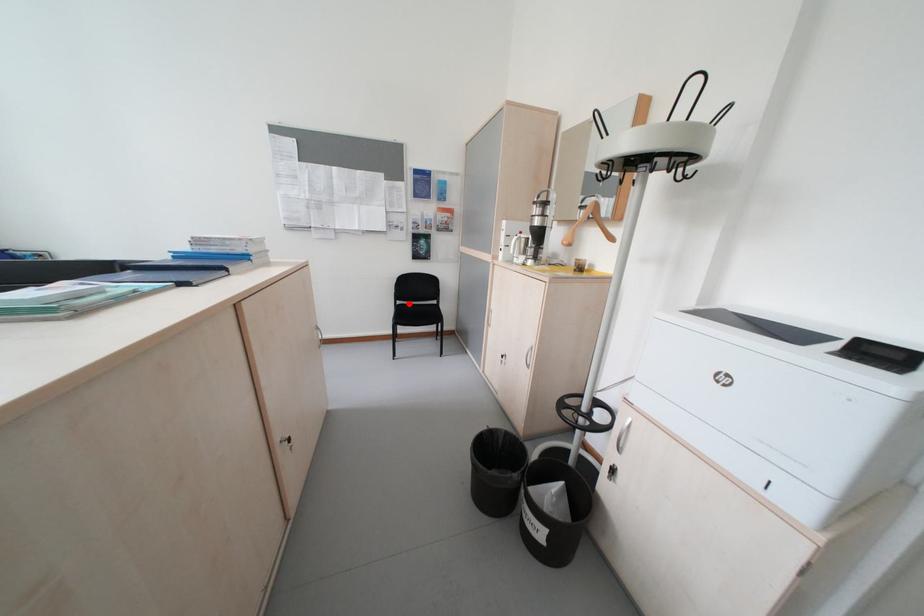
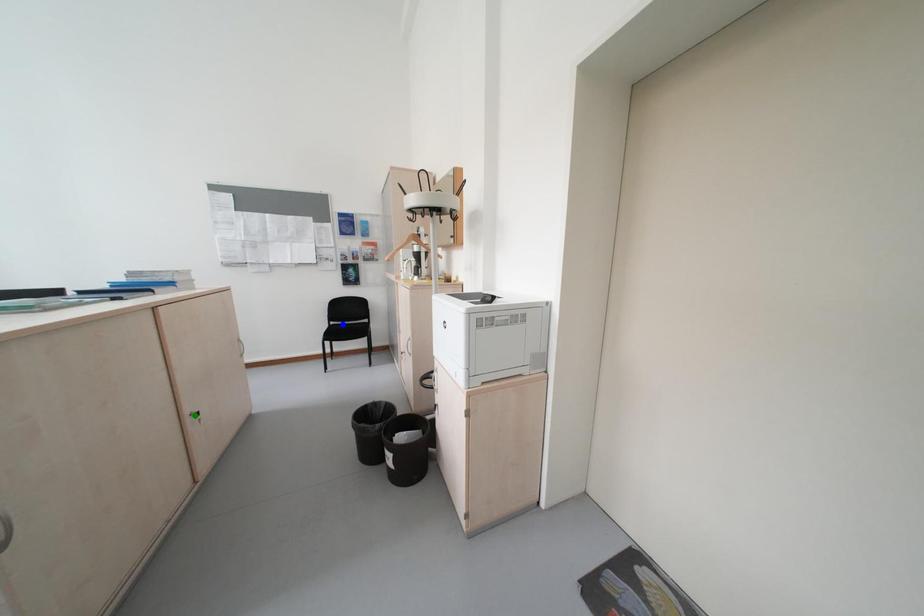
Question: I am providing you with two images of the same scene from different viewpoints. A red point is marked on the first image. You are given multiple points on the second image. Which point in image 2 is actually the same real-world point as the red point in image 1?

Choices:
 (A) yellow point
 (B) blue point
 (C) green point

Answer: (B)